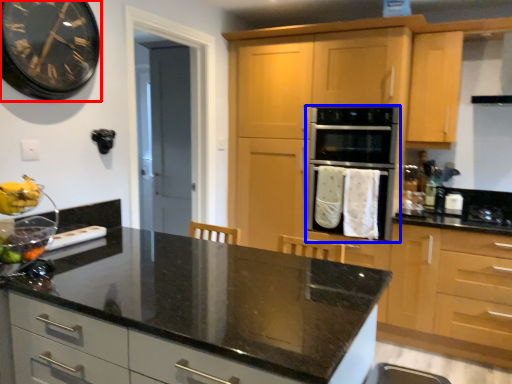
Question: Which object is further to the camera taking this photo, clock (highlighted by a red box) or oven (highlighted by a blue box)?

Choices:
 (A) clock
 (B) oven

Answer: (B)